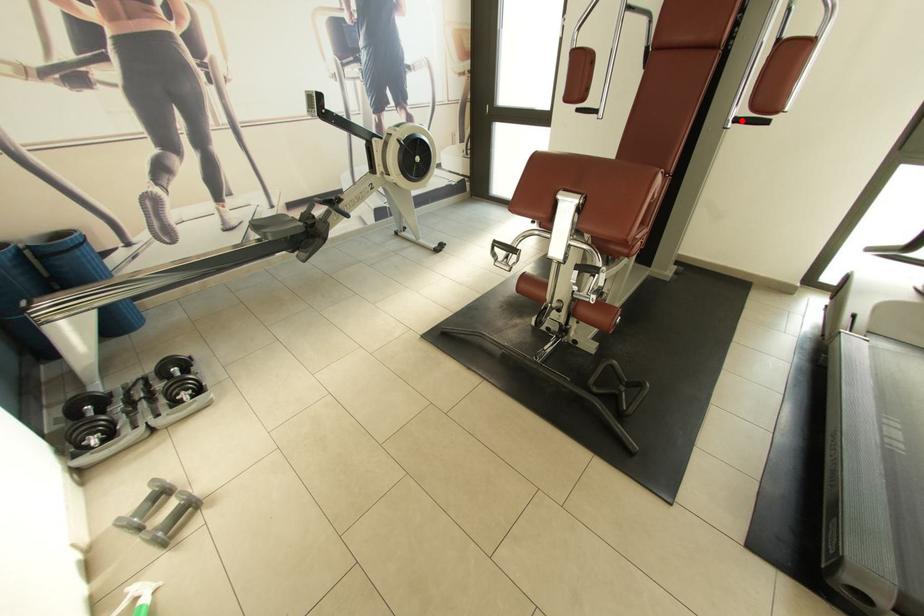
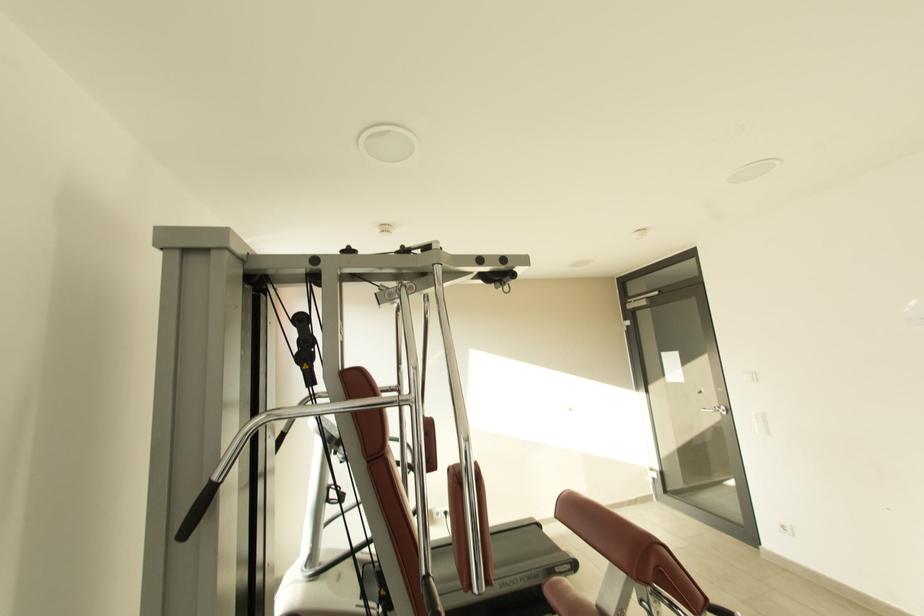
Question: I am providing you with two images of the same scene from different viewpoints. A red point is marked on the first image. At the location where the point appears in image 1, is it still visible in image 2?

Choices:
 (A) Yes
 (B) No

Answer: (B)